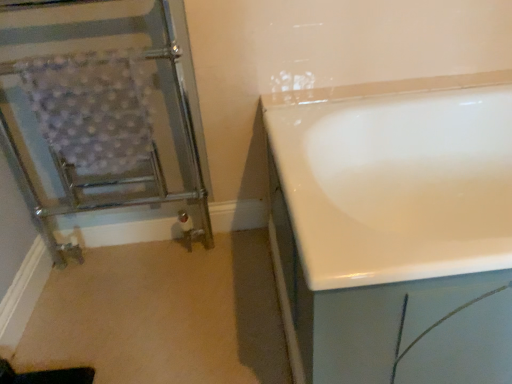
In order to face chrome metallic towel rack at left, should I rotate leftwards or rightwards?

Turn left by 19.766 degrees to look at chrome metallic towel rack at left.

What do you see at coordinates (156, 107) in the screenshot?
I see `chrome metallic towel rack at left` at bounding box center [156, 107].

Locate an element on the screen. The height and width of the screenshot is (384, 512). chrome metallic towel rack at left is located at coordinates (156, 107).

The width and height of the screenshot is (512, 384). Describe the element at coordinates (396, 178) in the screenshot. I see `white glossy bathtub at right` at that location.

This screenshot has width=512, height=384. I want to click on white glossy bathtub at right, so click(x=396, y=178).

Where is `chrome metallic towel rack at left`? Image resolution: width=512 pixels, height=384 pixels. chrome metallic towel rack at left is located at coordinates (156, 107).

Which is more to the left, white glossy bathtub at right or chrome metallic towel rack at left?

Positioned to the left is chrome metallic towel rack at left.

Is white glossy bathtub at right positioned behind chrome metallic towel rack at left?

No, white glossy bathtub at right is closer to the camera.

Considering the positions of points (279, 97) and (10, 103), is point (279, 97) closer to camera compared to point (10, 103)?

No, (279, 97) is behind (10, 103).

From the image's perspective, is white glossy bathtub at right located above chrome metallic towel rack at left?

No, from the image's perspective, white glossy bathtub at right is not over chrome metallic towel rack at left.

From a real-world perspective, is white glossy bathtub at right beneath chrome metallic towel rack at left?

Yes, from a real-world perspective, white glossy bathtub at right is beneath chrome metallic towel rack at left.

Is white glossy bathtub at right thinner than chrome metallic towel rack at left?

No.

Can you confirm if white glossy bathtub at right is shorter than chrome metallic towel rack at left?

Yes.

Considering the relative sizes of white glossy bathtub at right and chrome metallic towel rack at left in the image provided, is white glossy bathtub at right smaller than chrome metallic towel rack at left?

No, white glossy bathtub at right is not smaller than chrome metallic towel rack at left.

Consider the image. Would you say white glossy bathtub at right is inside or outside chrome metallic towel rack at left?

white glossy bathtub at right exists outside the volume of chrome metallic towel rack at left.

Can you see white glossy bathtub at right touching chrome metallic towel rack at left?

No, white glossy bathtub at right is not with chrome metallic towel rack at left.

Is white glossy bathtub at right oriented away from chrome metallic towel rack at left?

That's not correct — white glossy bathtub at right is not looking away from chrome metallic towel rack at left.

Can you tell me how much white glossy bathtub at right and chrome metallic towel rack at left differ in facing direction?

There is a 0.0796-degree angle between the facing directions of white glossy bathtub at right and chrome metallic towel rack at left.

Identify the location of bathtub in front of the chrome metallic towel rack at left. The height and width of the screenshot is (384, 512). (396, 178).

Which is more to the right, chrome metallic towel rack at left or white glossy bathtub at right?

Positioned to the right is white glossy bathtub at right.

Is the position of chrome metallic towel rack at left more distant than that of white glossy bathtub at right?

Yes, the depth of chrome metallic towel rack at left is greater than that of white glossy bathtub at right.

Is point (121, 46) closer or farther from the camera than point (433, 227)?

Point (121, 46) is closer to the camera than point (433, 227).

From the image's perspective, would you say chrome metallic towel rack at left is shown under white glossy bathtub at right?

No, from the image's perspective, chrome metallic towel rack at left is not beneath white glossy bathtub at right.

From a real-world perspective, is chrome metallic towel rack at left below white glossy bathtub at right?

Actually, chrome metallic towel rack at left is physically above white glossy bathtub at right in the real world.

Which object is wider, chrome metallic towel rack at left or white glossy bathtub at right?

With larger width is white glossy bathtub at right.

Considering the relative sizes of chrome metallic towel rack at left and white glossy bathtub at right in the image provided, is chrome metallic towel rack at left shorter than white glossy bathtub at right?

Incorrect, the height of chrome metallic towel rack at left does not fall short of that of white glossy bathtub at right.

Is chrome metallic towel rack at left bigger or smaller than white glossy bathtub at right?

chrome metallic towel rack at left is smaller than white glossy bathtub at right.

Is chrome metallic towel rack at left located outside white glossy bathtub at right?

Yes, chrome metallic towel rack at left is located beyond the bounds of white glossy bathtub at right.

Is chrome metallic towel rack at left in contact with white glossy bathtub at right?

No.

Is white glossy bathtub at right at the back of chrome metallic towel rack at left?

That's not correct — chrome metallic towel rack at left is not looking away from white glossy bathtub at right.

How different are the orientations of chrome metallic towel rack at left and white glossy bathtub at right in degrees?

The angular difference between chrome metallic towel rack at left and white glossy bathtub at right is 0.0796 degrees.

How distant is chrome metallic towel rack at left from white glossy bathtub at right?

chrome metallic towel rack at left is 23.76 inches from white glossy bathtub at right.

Locate an element on the screen. Image resolution: width=512 pixels, height=384 pixels. bathtub in front of the chrome metallic towel rack at left is located at coordinates (396, 178).

The height and width of the screenshot is (384, 512). What are the coordinates of `screen door on the left of white glossy bathtub at right` in the screenshot? It's located at (156, 107).

The height and width of the screenshot is (384, 512). I want to click on screen door that is above the white glossy bathtub at right (from a real-world perspective), so click(156, 107).